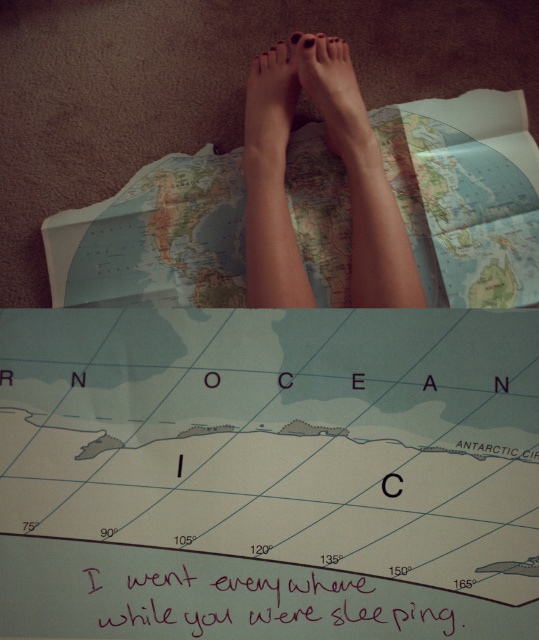
You are trying to place a matte skin foot at center on top of the light blue paper map at center. Will the foot fit entirely on the map?

The light blue paper map at center might be wider than matte skin foot at center, so it is possible that the foot will fit entirely on the map.

You are an archaeologist examining the image. You need to determine if the handwritten ink writing at center is visible through the light blue paper map at center. Can you see it?

The handwritten ink writing at center is behind light blue paper map at center, so it is not visible through the map.